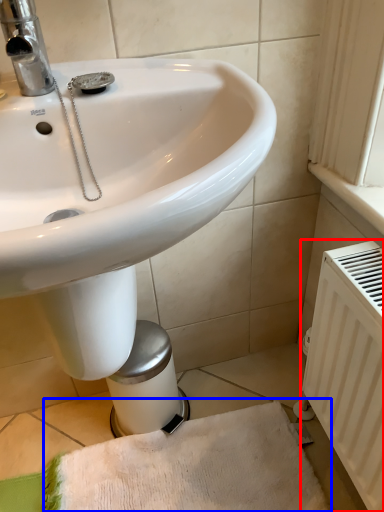
Question: Which point is closer to the camera, radiator (highlighted by a red box) or bath towel (highlighted by a blue box)?

Choices:
 (A) radiator
 (B) bath towel

Answer: (A)